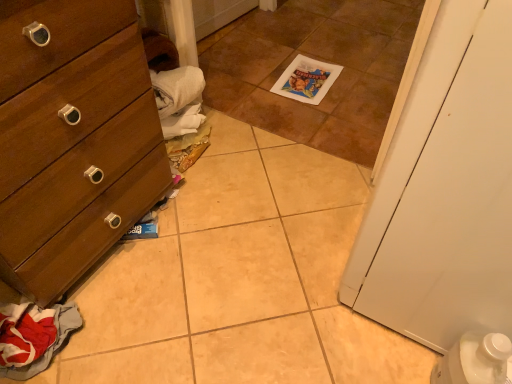
Question: Does white matte door at right have a greater height compared to brown tile at center?

Choices:
 (A) no
 (B) yes

Answer: (B)

Question: Is white matte door at right wider than brown tile at center?

Choices:
 (A) yes
 (B) no

Answer: (B)

Question: From the image's perspective, is white matte door at right on top of brown tile at center?

Choices:
 (A) yes
 (B) no

Answer: (B)

Question: Is white matte door at right completely or partially outside of brown tile at center?

Choices:
 (A) yes
 (B) no

Answer: (A)

Question: Can you confirm if white matte door at right is positioned to the right of brown tile at center?

Choices:
 (A) no
 (B) yes

Answer: (B)

Question: Is red fabric clothes at lower left in front of or behind wooden dresser at left in the image?

Choices:
 (A) behind
 (B) front

Answer: (A)

Question: Looking at the image, does red fabric clothes at lower left seem bigger or smaller compared to wooden dresser at left?

Choices:
 (A) big
 (B) small

Answer: (B)

Question: From their relative heights in the image, would you say red fabric clothes at lower left is taller or shorter than wooden dresser at left?

Choices:
 (A) short
 (B) tall

Answer: (A)

Question: In terms of width, does red fabric clothes at lower left look wider or thinner when compared to wooden dresser at left?

Choices:
 (A) wide
 (B) thin

Answer: (B)

Question: Considering the positions of point (330, 135) and point (500, 67), is point (330, 135) closer or farther from the camera than point (500, 67)?

Choices:
 (A) closer
 (B) farther

Answer: (B)

Question: From a real-world perspective, relative to white matte door at right, is brown tile at center vertically above or below?

Choices:
 (A) above
 (B) below

Answer: (B)

Question: In terms of width, does brown tile at center look wider or thinner when compared to white matte door at right?

Choices:
 (A) thin
 (B) wide

Answer: (B)

Question: Considering the positions of brown tile at center and white matte door at right in the image, is brown tile at center taller or shorter than white matte door at right?

Choices:
 (A) tall
 (B) short

Answer: (B)

Question: From their relative heights in the image, would you say brown tile at center is taller or shorter than wooden dresser at left?

Choices:
 (A) short
 (B) tall

Answer: (A)

Question: Considering their positions, is brown tile at center located in front of or behind wooden dresser at left?

Choices:
 (A) front
 (B) behind

Answer: (B)